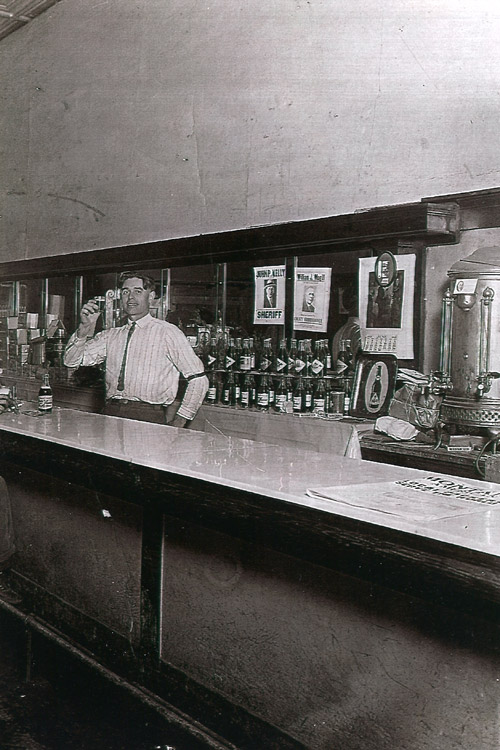
You are a GUI agent. You are given a task and a screenshot of the screen. Output one action in this format:
    pyautogui.click(x=<x>, y=<y>)
    Task: Click on the countertop
    The height and width of the screenshot is (750, 500).
    Given the screenshot: What is the action you would take?
    pyautogui.click(x=160, y=448)